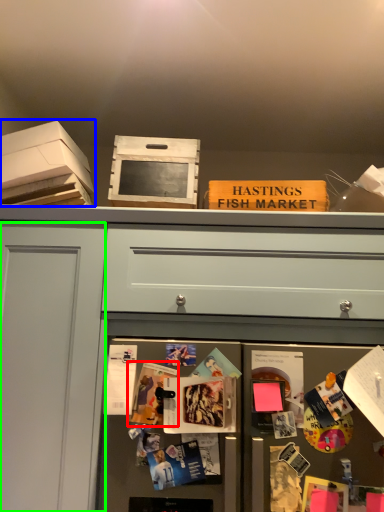
Question: Based on their relative distances, which object is farther from magazine (highlighted by a red box)? Choose from cardboard box (highlighted by a blue box) and glass door (highlighted by a green box).

Choices:
 (A) cardboard box
 (B) glass door

Answer: (A)